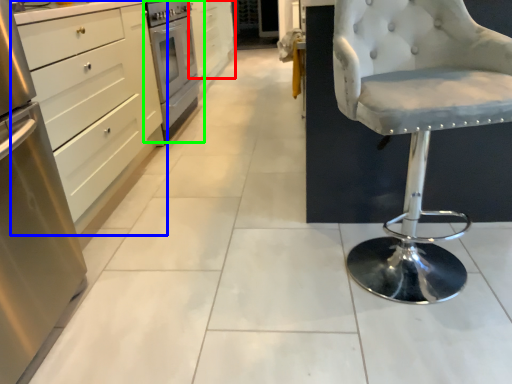
Question: Considering the real-world distances, which object is closest to cabinetry (highlighted by a red box)? cabinetry (highlighted by a blue box) or home appliance (highlighted by a green box).

Choices:
 (A) cabinetry
 (B) home appliance

Answer: (B)